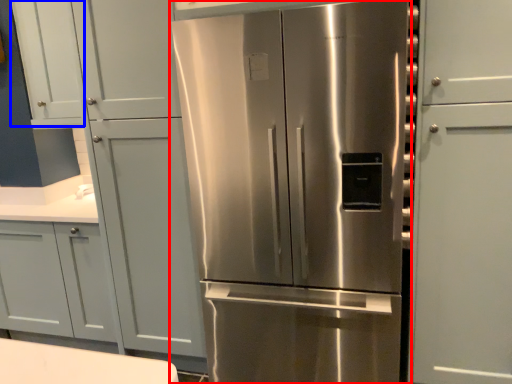
Question: Which object is further to the camera taking this photo, refrigerator (highlighted by a red box) or door (highlighted by a blue box)?

Choices:
 (A) refrigerator
 (B) door

Answer: (B)